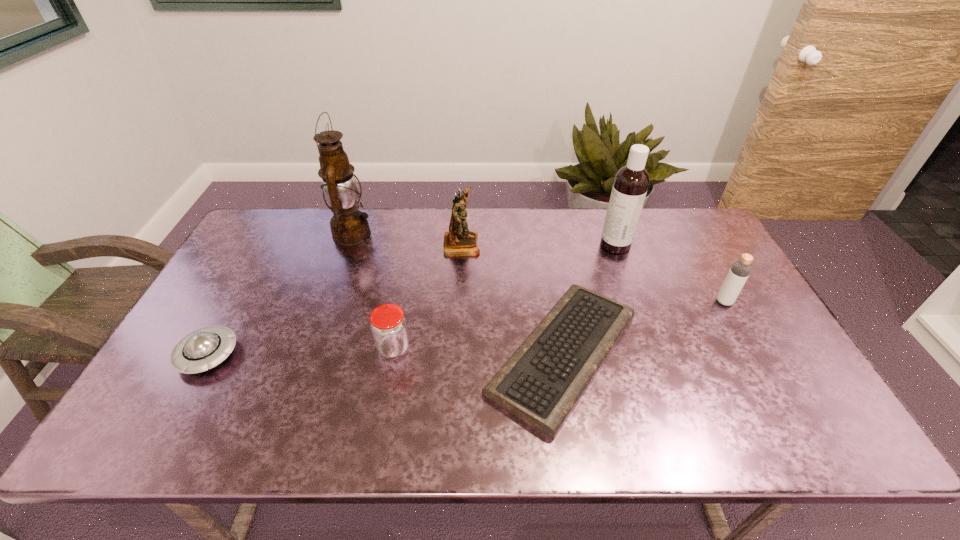
Image resolution: width=960 pixels, height=540 pixels. What are the coordinates of `vacant space at the far right corner of the desktop` in the screenshot? It's located at (670, 224).

In order to click on vacant region between the saucer and the fourth object from left to right in this screenshot , I will do `click(335, 299)`.

The image size is (960, 540). I want to click on vacant point located between the tallest object and the dishwasher detergent, so click(x=484, y=240).

Image resolution: width=960 pixels, height=540 pixels. What are the coordinates of `free space between the second tallest object and the tallest object` in the screenshot? It's located at (484, 240).

You are a GUI agent. You are given a task and a screenshot of the screen. Output one action in this format:
    pyautogui.click(x=<x>, y=<y>)
    Task: Click on the vacant point located between the sixth shortest object and the sixth tallest object
    Image resolution: width=960 pixels, height=540 pixels.
    Given the screenshot: What is the action you would take?
    pyautogui.click(x=412, y=300)

The width and height of the screenshot is (960, 540). I want to click on vacant area between the figurine and the tallest object, so click(407, 239).

You are a GUI agent. You are given a task and a screenshot of the screen. Output one action in this format:
    pyautogui.click(x=<x>, y=<y>)
    Task: Click on the unoccupied position between the oil lamp and the rightmost object
    Image resolution: width=960 pixels, height=540 pixels.
    Given the screenshot: What is the action you would take?
    pyautogui.click(x=539, y=268)

You are a GUI agent. You are given a task and a screenshot of the screen. Output one action in this format:
    pyautogui.click(x=<x>, y=<y>)
    Task: Click on the vacant point located between the sixth object from right to left and the shortest object
    The width and height of the screenshot is (960, 540).
    Given the screenshot: What is the action you would take?
    pyautogui.click(x=458, y=294)

At what (x,y) coordinates should I click in order to perform the action: click on vacant point located between the fourth shortest object and the computer keyboard. Please return your answer as a coordinate pair (x, y). The width and height of the screenshot is (960, 540). Looking at the image, I should click on (643, 328).

Where is `blank region between the fifth tallest object and the computer keyboard`? The height and width of the screenshot is (540, 960). blank region between the fifth tallest object and the computer keyboard is located at coordinates (478, 351).